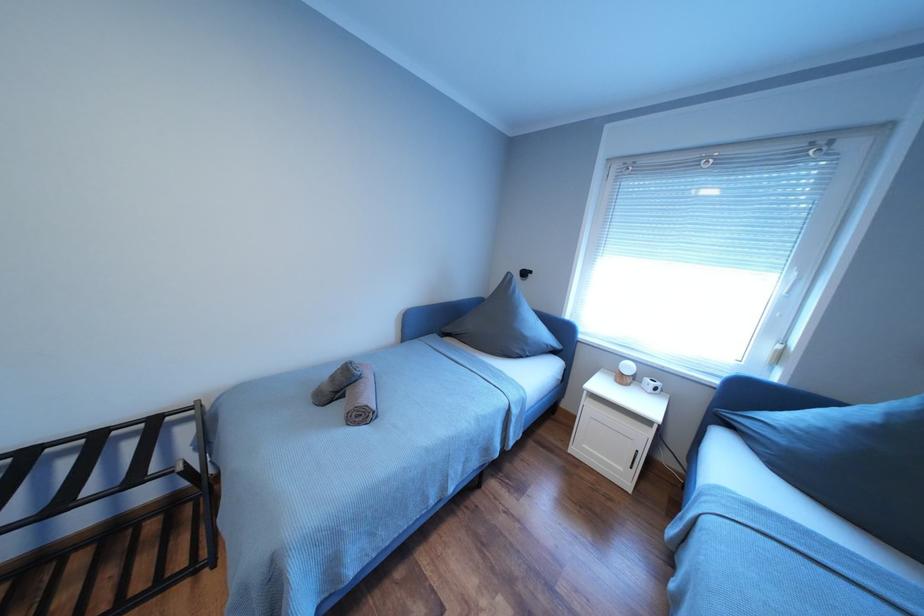
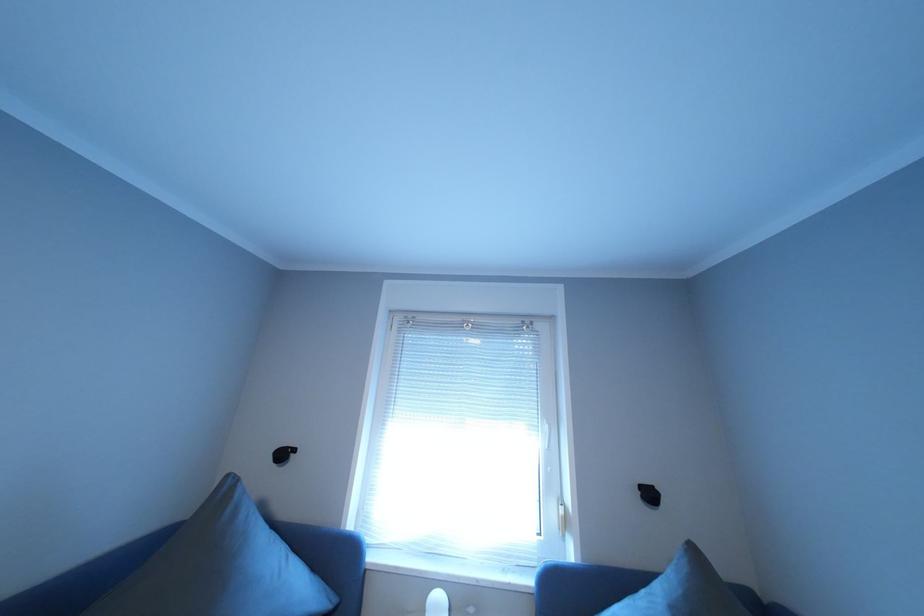
The images are taken continuously from a first-person perspective. In which direction is your viewpoint rotating?

The camera's rotation is toward right-up.